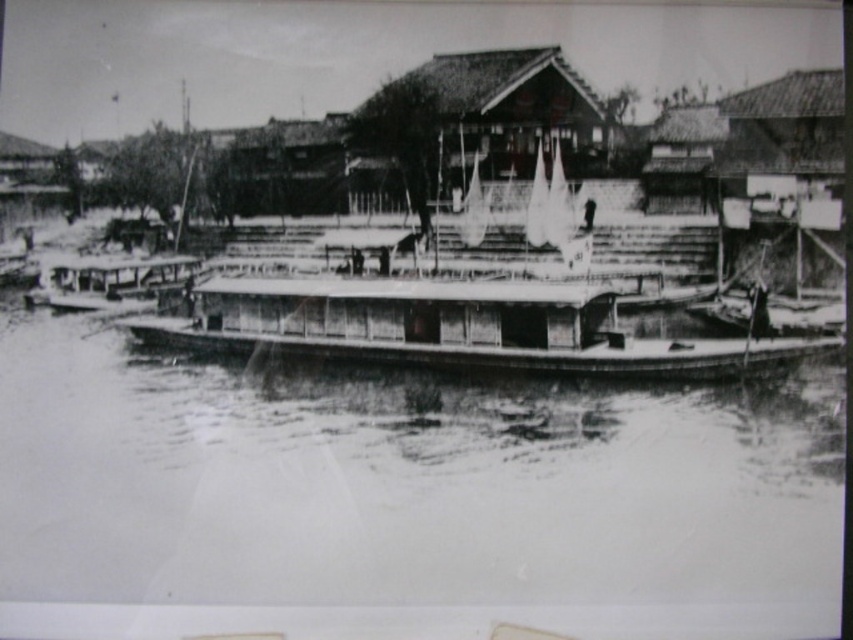
You are standing at the waterfront and want to take a photo of both point (190, 408) and point (540, 337) in the image. Which point should you focus on first to ensure both are in sharp focus?

You should focus on point (190, 408) first because it is closer to the camera than point (540, 337). By focusing on the closer point, the farther point will also be within the depth of field and in focus.